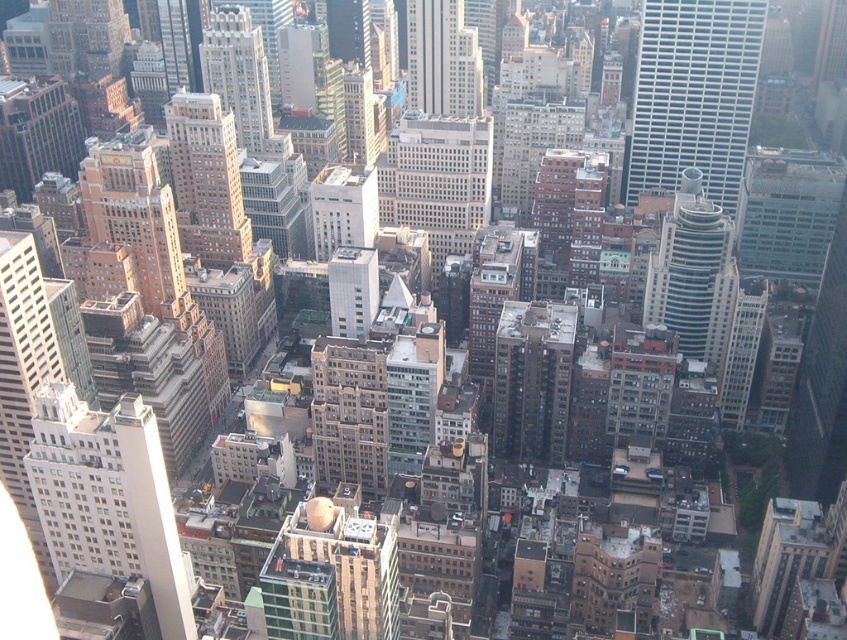
Is white smooth building at center-left to the left of white glass skyscraper at upper right from the viewer's perspective?

Correct, you'll find white smooth building at center-left to the left of white glass skyscraper at upper right.

What do you see at coordinates (108, 499) in the screenshot?
I see `white smooth building at center-left` at bounding box center [108, 499].

I want to click on white smooth building at center-left, so click(x=108, y=499).

You are a GUI agent. You are given a task and a screenshot of the screen. Output one action in this format:
    pyautogui.click(x=<x>, y=<y>)
    Task: Click on the white smooth building at center-left
    The height and width of the screenshot is (640, 847).
    Given the screenshot: What is the action you would take?
    pyautogui.click(x=108, y=499)

Is brown brick building at center behind smooth glass skyscraper at center?

Yes, brown brick building at center is further from the viewer.

Which is behind, point (167, 125) or point (477, 51)?

Positioned behind is point (167, 125).

Who is more distant from viewer, (209, 198) or (427, 42)?

The point (427, 42) is more distant.

This screenshot has height=640, width=847. What are the coordinates of `brown brick building at center` in the screenshot? It's located at (206, 180).

Can you confirm if white smooth building at center-left is thinner than green glass tower at center-right?

No.

Which is below, white smooth building at center-left or green glass tower at center-right?

Positioned lower is white smooth building at center-left.

Who is more forward, (137, 564) or (692, 241)?

Positioned in front is point (137, 564).

Locate an element on the screen. white smooth building at center-left is located at coordinates (108, 499).